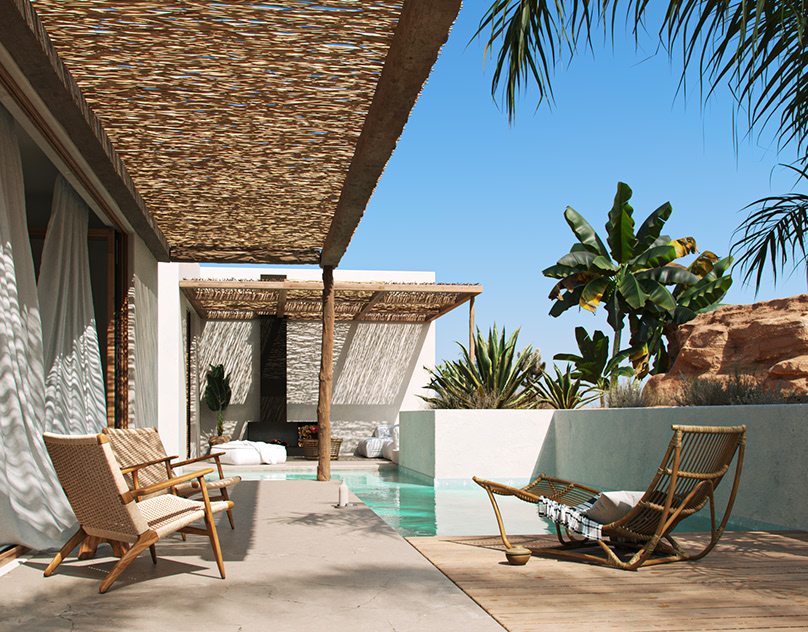
Where is `white curtains`? white curtains is located at coordinates (60, 264), (6, 336).